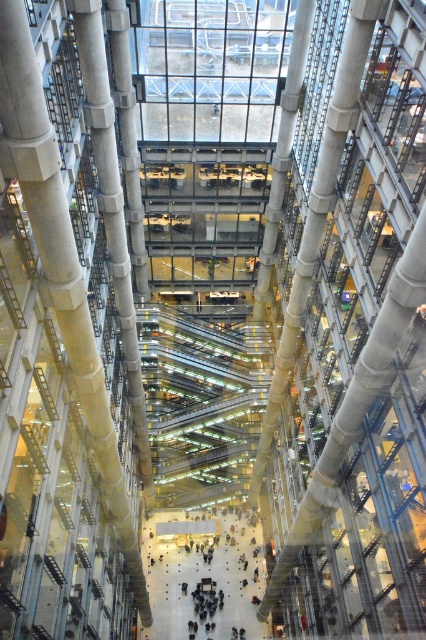
You are standing at the entrance of the building and want to walk directly to the dark gray concrete floor at center. What direction should you move in?

Since the dark gray concrete floor at center is located at point coordinates of 0.900 on the x axis and 0.474 on the y axis, you should move forward in the direction of the central atrium to reach it.